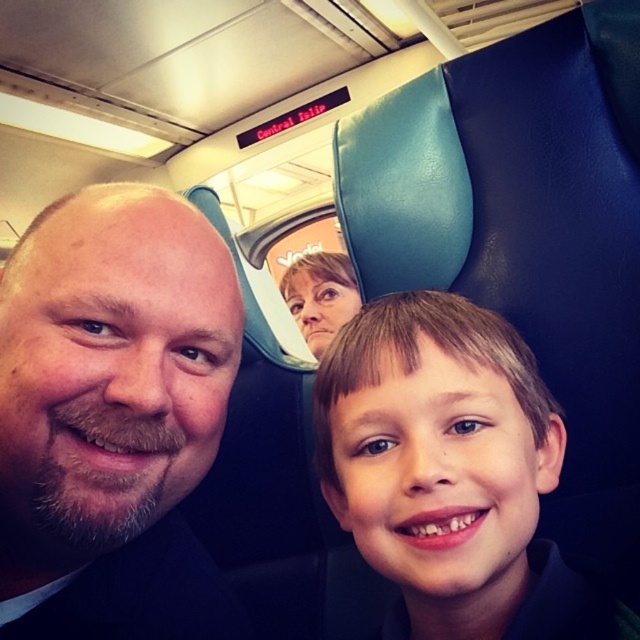
Can you confirm if brown beard at center is taller than smooth skin face at center?

Indeed, brown beard at center has a greater height compared to smooth skin face at center.

From the picture: Which is more to the left, brown beard at center or smooth skin face at center?

brown beard at center

This screenshot has height=640, width=640. What do you see at coordinates (113, 413) in the screenshot? I see `brown beard at center` at bounding box center [113, 413].

You are a GUI agent. You are given a task and a screenshot of the screen. Output one action in this format:
    pyautogui.click(x=<x>, y=<y>)
    Task: Click on the brown beard at center
    
    Given the screenshot: What is the action you would take?
    pyautogui.click(x=113, y=413)

Can you confirm if smooth skin face at center is smaller than matte skin face at center?

Yes.

Is point (436, 595) positioned behind point (324, 253)?

No, it is not.

Is point (323, 358) more distant than point (301, 330)?

No, (323, 358) is in front of (301, 330).

At what (x,y) coordinates should I click in order to perform the action: click on smooth skin face at center. Please return your answer as a coordinate pair (x, y). This screenshot has height=640, width=640. Looking at the image, I should click on (451, 472).

Does brown beard at center appear under matte skin face at center?

Correct, brown beard at center is located below matte skin face at center.

Does point (118, 572) come farther from viewer compared to point (326, 282)?

That is False.

Where is `brown beard at center`? This screenshot has height=640, width=640. brown beard at center is located at coordinates (113, 413).